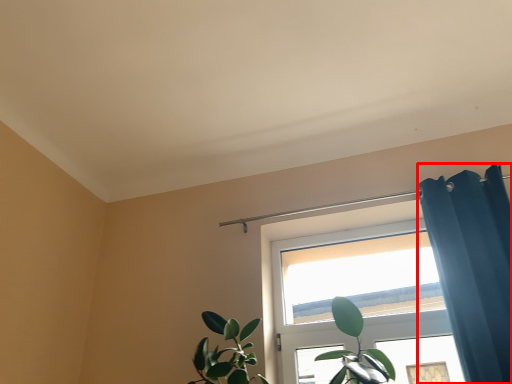
Question: From the image, what is the correct spatial relationship of shower curtain (annotated by the red box) in relation to window?

Choices:
 (A) right
 (B) left

Answer: (A)